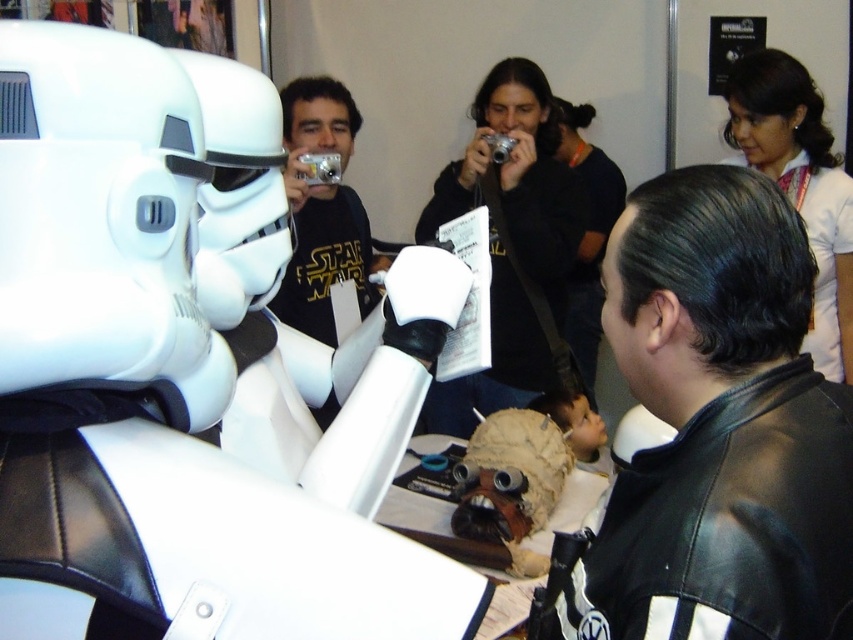
You are a photographer at the event and want to capture both the black leather jacket at center and the smooth skin nose at upper center in a single shot. Which object should you focus on first to ensure both are in frame?

You should focus on the black leather jacket at center first since it is positioned below the smooth skin nose at upper center, meaning it is closer to the camera. By focusing on the closer object, both will be in the frame.

You are a photographer at the event and need to take a clear photo of the smooth skin nose at upper center. However, the black leather jacket at center is blocking your view. Can you move around to capture the nose without obstruction?

The black leather jacket at center is in front of the smooth skin nose at upper center, so moving around to the side or behind the jacket might allow you to capture the nose without obstruction.